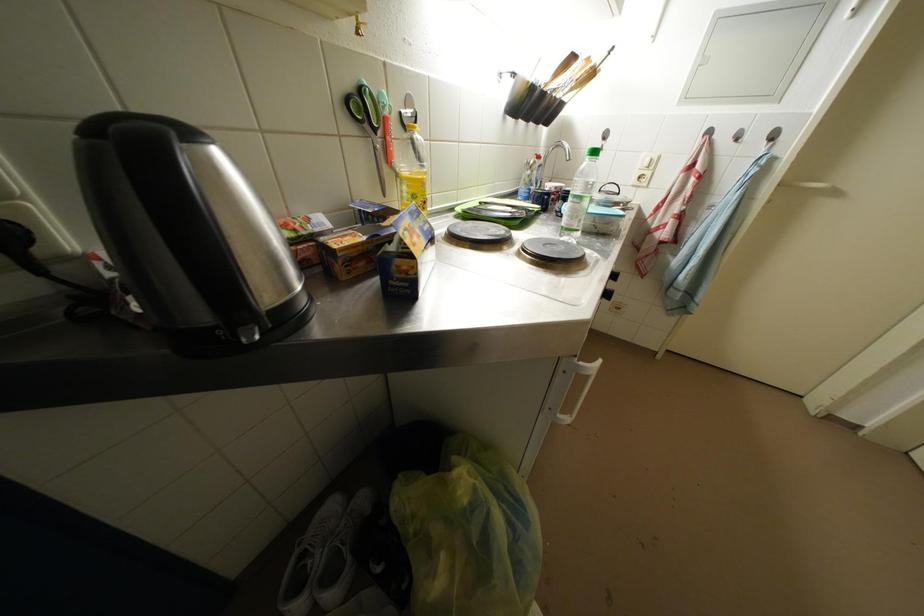
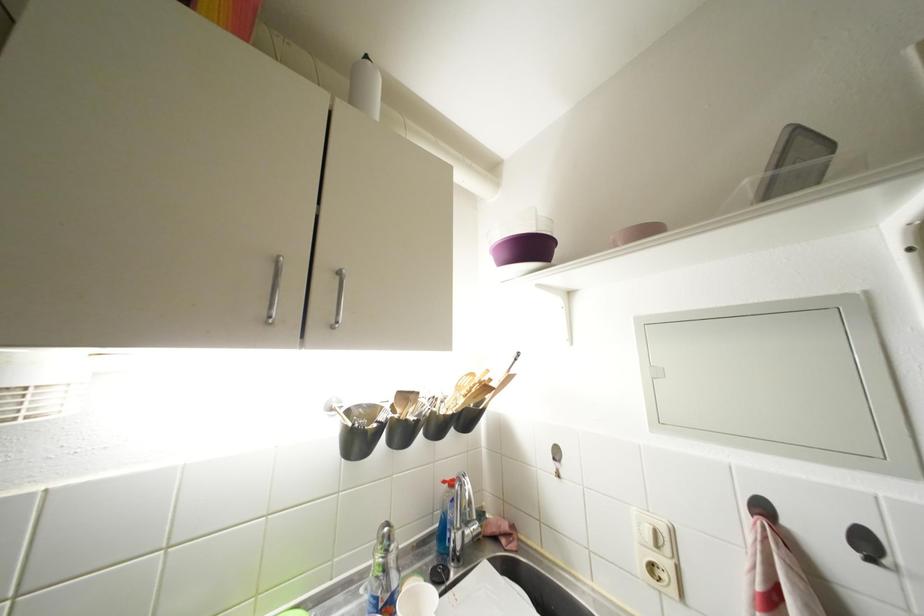
The point at (744, 145) is marked in the first image. Where is the corresponding point in the second image?

(877, 565)